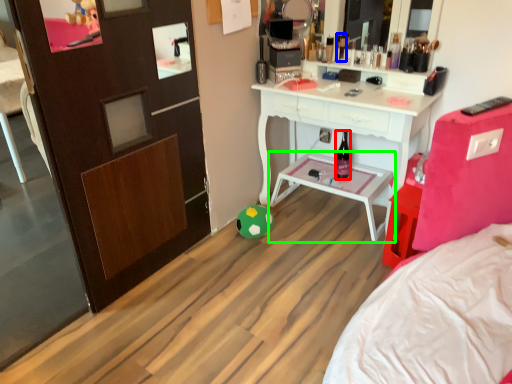
Question: Which object is positioned farthest from bottle (highlighted by a red box)? Select from toiletry (highlighted by a blue box) and table (highlighted by a green box).

Choices:
 (A) toiletry
 (B) table

Answer: (A)